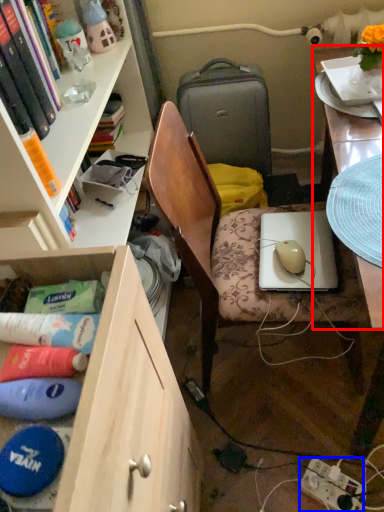
Question: Which object appears closest to the camera in this image, desk (highlighted by a red box) or power outlet (highlighted by a blue box)?

Choices:
 (A) desk
 (B) power outlet

Answer: (A)